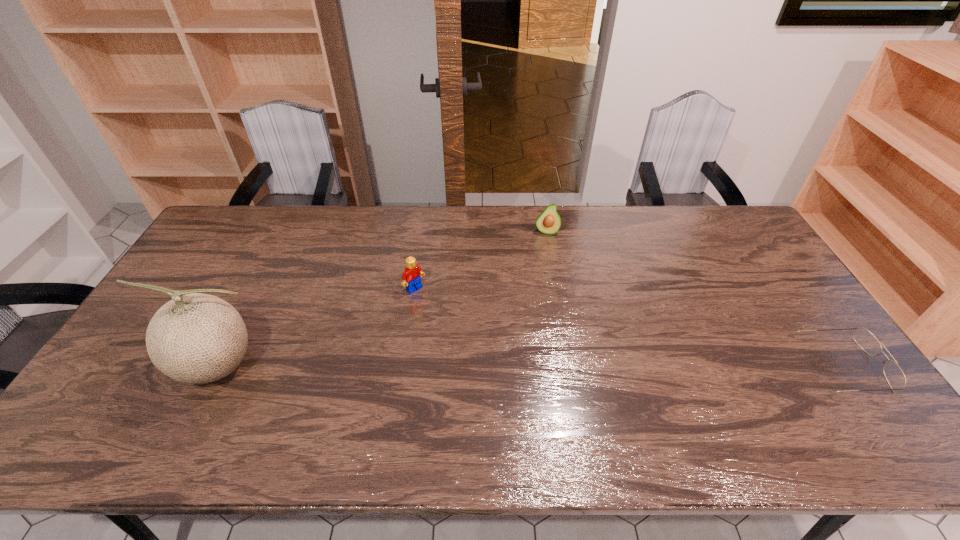
Locate an element on the screen. free spot on the desktop that is between the leftmost object and the shortest object and is positioned on the front-facing side of the Lego is located at coordinates (504, 366).

Image resolution: width=960 pixels, height=540 pixels. Identify the location of vacant space on the desktop that is between the cantaloup and the shortest object and is positioned on the cut side of the farthest object. (543, 366).